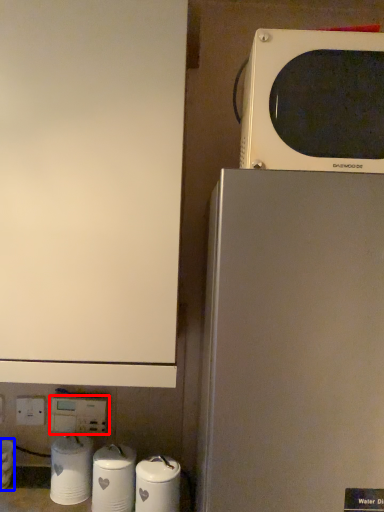
Question: Which object is closer to the camera taking this photo, electric outlet (highlighted by a red box) or appliance (highlighted by a blue box)?

Choices:
 (A) electric outlet
 (B) appliance

Answer: (B)